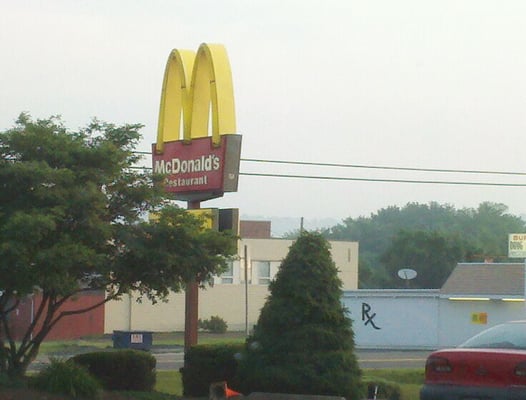
Identify the location of restaurant. (192, 179).